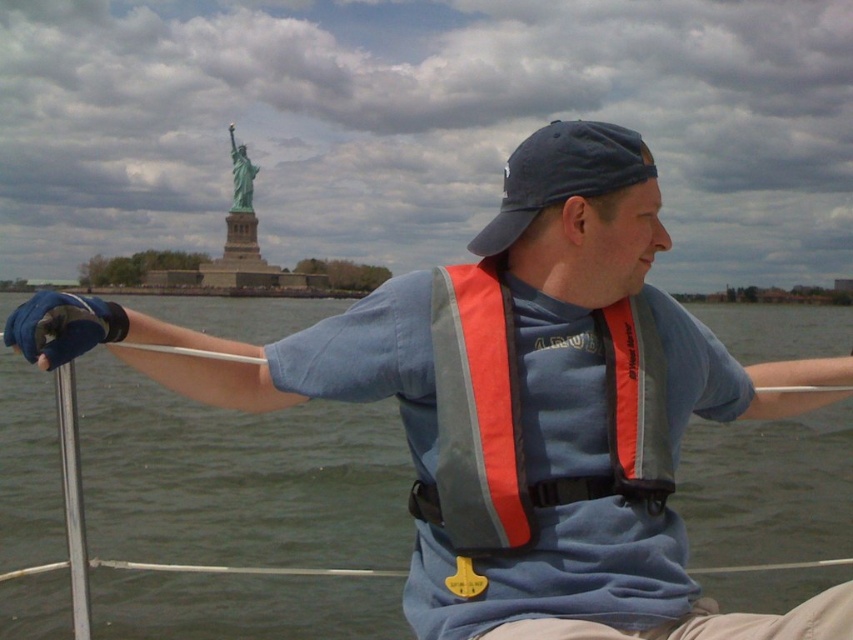
Who is more distant from viewer, [595,166] or [248,202]?

The point [248,202] is behind.

The image size is (853, 640). What do you see at coordinates (561, 173) in the screenshot? I see `blue fabric baseball cap at center` at bounding box center [561, 173].

Does point (560, 180) come behind point (241, 156)?

No, (560, 180) is in front of (241, 156).

Find the location of a particular element. blue fabric baseball cap at center is located at coordinates (561, 173).